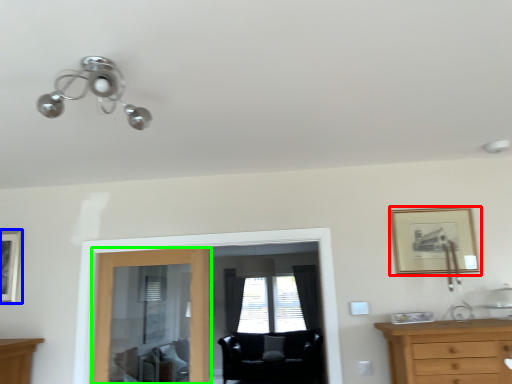
Question: Considering the real-world distances, which object is farthest from picture frame (highlighted by a red box)? picture frame (highlighted by a blue box) or door (highlighted by a green box)?

Choices:
 (A) picture frame
 (B) door

Answer: (A)